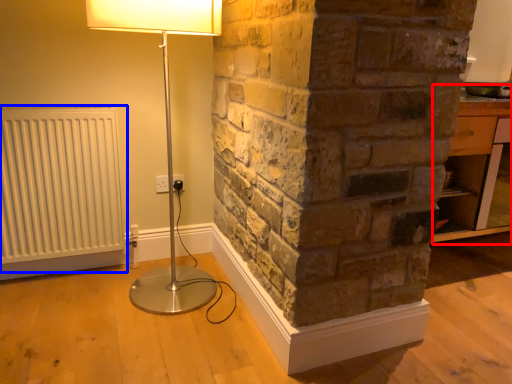
Question: Which object is closer to the camera taking this photo, table (highlighted by a red box) or radiator (highlighted by a blue box)?

Choices:
 (A) table
 (B) radiator

Answer: (B)